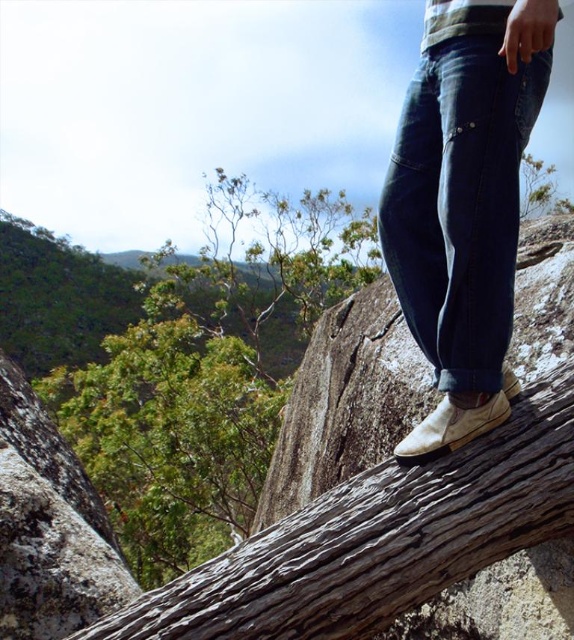
From the picture: Is green leafy tree at center smaller than dark blue denim jeans at center?

Actually, green leafy tree at center might be larger than dark blue denim jeans at center.

Does green leafy tree at center come behind dark blue denim jeans at center?

Yes, green leafy tree at center is behind dark blue denim jeans at center.

Is point (250, 419) positioned behind point (383, 221)?

Yes, it is.

This screenshot has width=574, height=640. I want to click on green leafy tree at center, so click(207, 371).